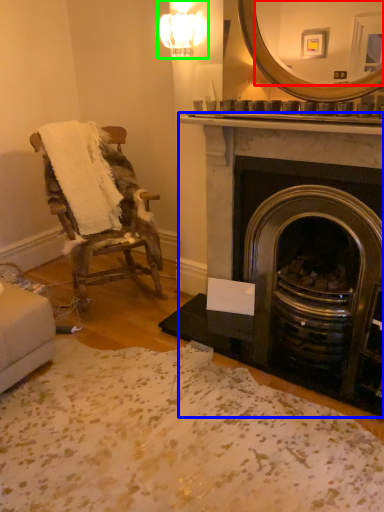
Question: Which is nearer to the mirror (highlighted by a red box)? fireplace (highlighted by a blue box) or light fixture (highlighted by a green box).

Choices:
 (A) fireplace
 (B) light fixture

Answer: (A)